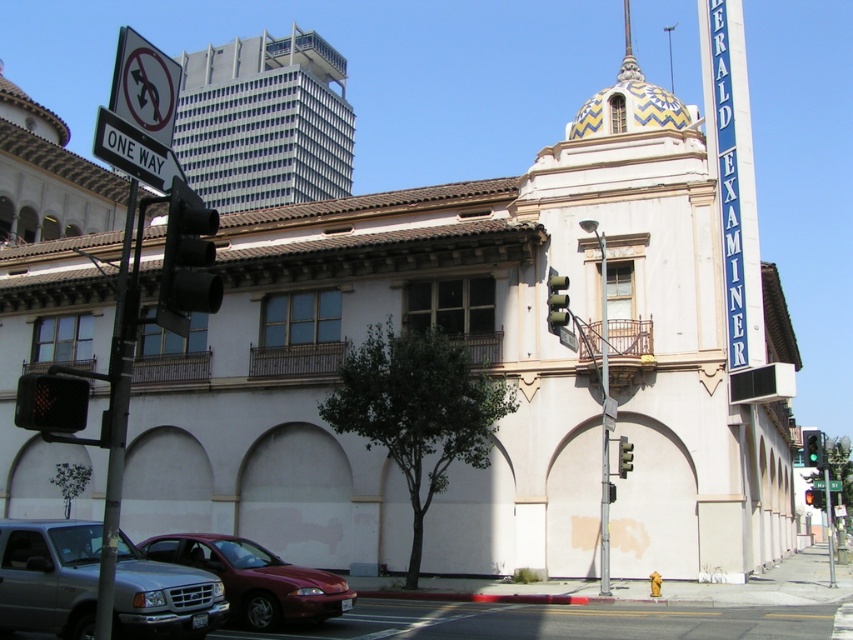
Is metallic red sedan at lower left to the right of green glass traffic light at center from the viewer's perspective?

In fact, metallic red sedan at lower left is to the left of green glass traffic light at center.

Find the location of a particular element. metallic red sedan at lower left is located at coordinates (254, 579).

Who is shorter, silver metallic truck at lower left or black plastic traffic light at left?

silver metallic truck at lower left is shorter.

Is silver metallic truck at lower left positioned before black plastic traffic light at left?

No, it is behind black plastic traffic light at left.

Between point (183, 620) and point (173, 289), which one is positioned in front?

Point (173, 289) is more forward.

Find the location of a particular element. This screenshot has width=853, height=640. silver metallic truck at lower left is located at coordinates (49, 576).

Is point (78, 534) farther from camera compared to point (80, 417)?

Yes, it is.

Does silver metallic truck at lower left have a greater height compared to black plastic pedestrian signal at lower left?

No, silver metallic truck at lower left is not taller than black plastic pedestrian signal at lower left.

Between point (70, 609) and point (53, 394), which one is positioned in front?

Point (53, 394) is more forward.

Where is `silver metallic truck at lower left`? silver metallic truck at lower left is located at coordinates (49, 576).